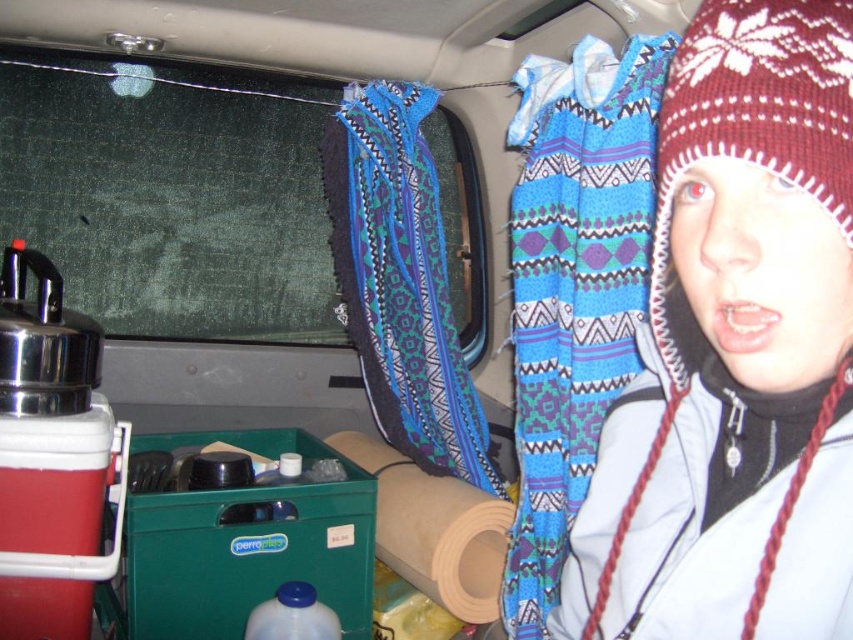
You are organizing items in the vehicle and need to place a new item between the blue woven blanket at upper center and the blue woven blanket at center. Based on their positions, where should you place the new item?

The blue woven blanket at upper center is located below the blue woven blanket at center, so you should place the new item between them by positioning it above the blue woven blanket at upper center and below the blue woven blanket at center.

You are a passenger in the vehicle and want to cover yourself with the items available. Which item, the knitted woolen hat at upper right or the blue woven blanket at center, would be more suitable for covering a larger body area?

The blue woven blanket at center would be more suitable for covering a larger body area since it is bigger in size compared to the knitted woolen hat at upper right.

You are a passenger in the van and need to grab the blue woven blanket at center to cover yourself. Which direction should you move to reach it from the knitted woolen hat at upper right?

The knitted woolen hat at upper right is positioned on the right side of the blue woven blanket at center, so you should move to the left to reach the blue woven blanket at center.